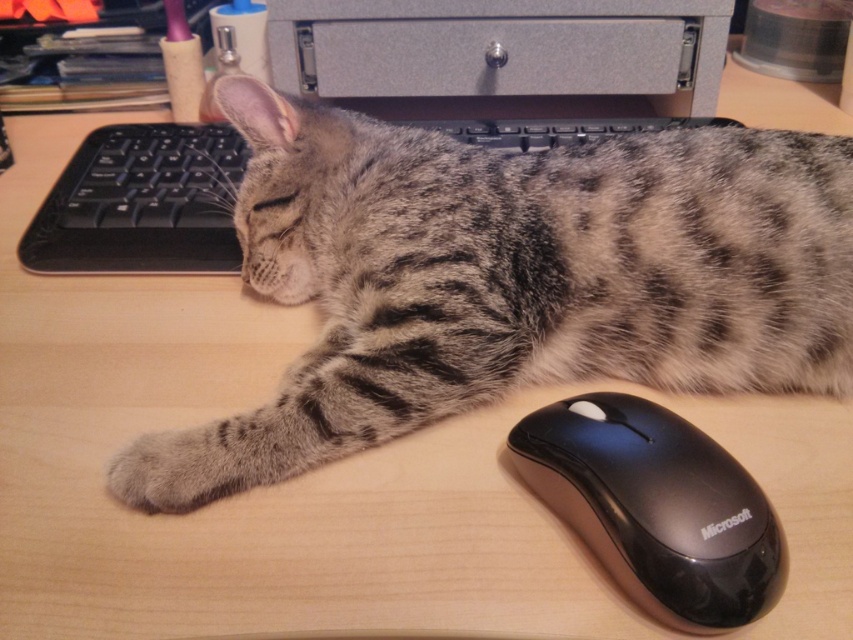
Question: Which object is the farthest from the metallic gray computer at upper center?

Choices:
 (A) gray striped fur cat at center
 (B) black plastic keyboard at upper center

Answer: (A)

Question: Observing the image, what is the correct spatial positioning of gray striped fur cat at center in reference to metallic gray computer at upper center?

Choices:
 (A) left
 (B) right

Answer: (A)

Question: Does gray striped fur cat at center have a larger size compared to metallic gray computer at upper center?

Choices:
 (A) yes
 (B) no

Answer: (A)

Question: Is metallic gray computer at upper center positioned before black plastic keyboard at upper center?

Choices:
 (A) yes
 (B) no

Answer: (B)

Question: Estimate the real-world distances between objects in this image. Which object is farther from the black plastic keyboard at upper center?

Choices:
 (A) metallic gray computer at upper center
 (B) black plastic mouse at lower right

Answer: (B)

Question: Among these objects, which one is farthest from the camera?

Choices:
 (A) black plastic mouse at lower right
 (B) metallic gray computer at upper center
 (C) black plastic keyboard at upper center
 (D) gray striped fur cat at center

Answer: (B)